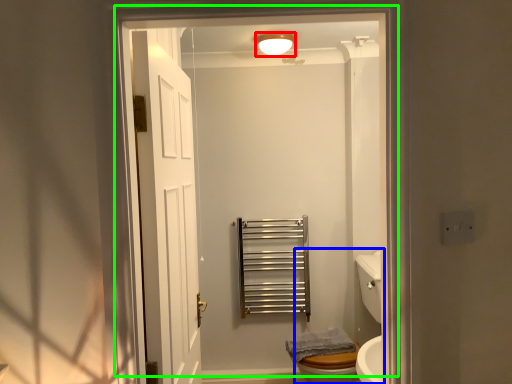
Question: Which object is the closest to the light fixture (highlighted by a red box)? Choose among these: sink (highlighted by a blue box) or door (highlighted by a green box).

Choices:
 (A) sink
 (B) door

Answer: (A)